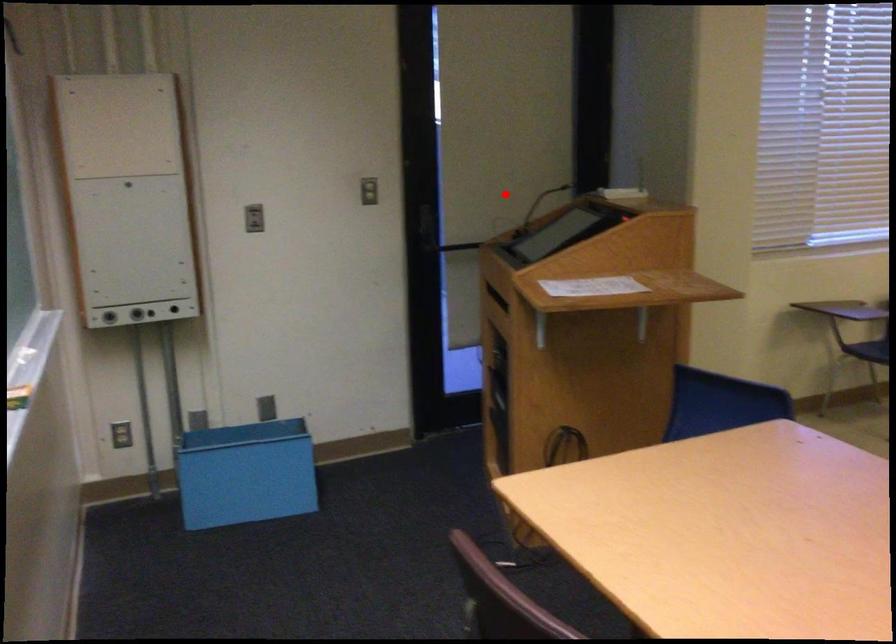
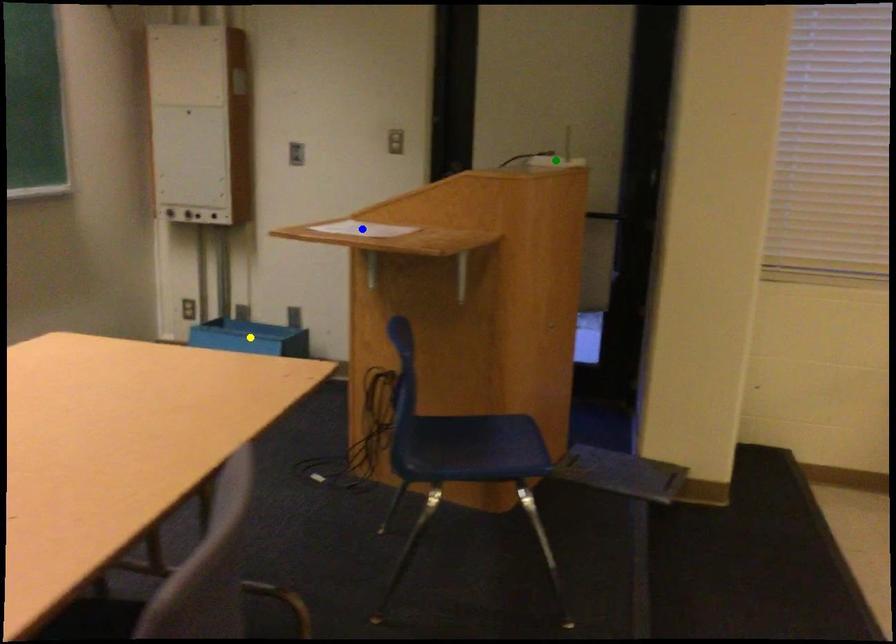
Question: I am providing you with two images of the same scene from different viewpoints. A red point is marked on the first image. You are given multiple points on the second image. Which mark in image 2 goes with the point in image 1?

Choices:
 (A) green point
 (B) yellow point
 (C) blue point

Answer: (A)